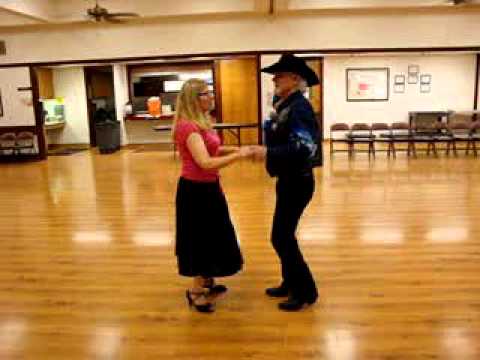
Where is `largest frame`? This screenshot has width=480, height=360. largest frame is located at coordinates (367, 70).